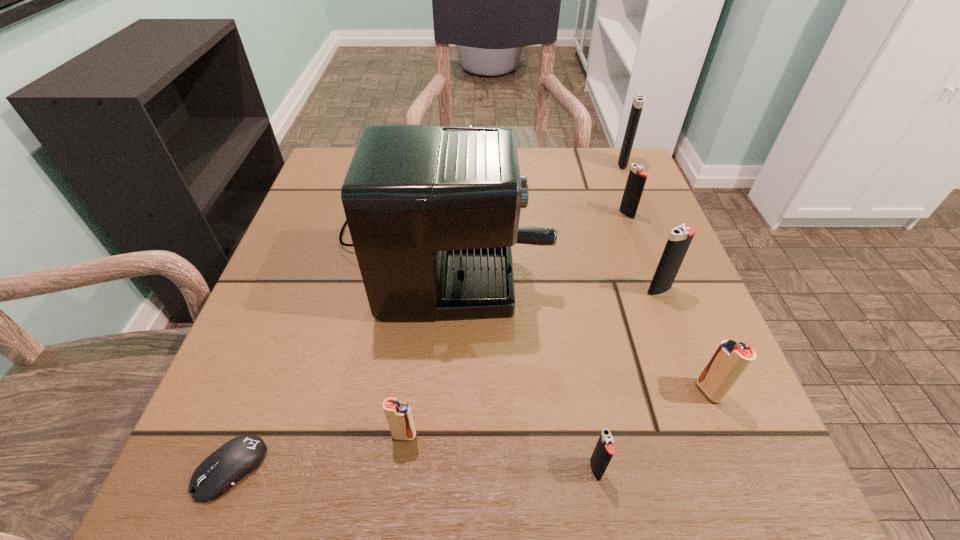
At what (x,y) coordinates should I click in order to perform the action: click on empty space that is in between the computer equipment and the black coffee maker. Please return your answer as a coordinate pair (x, y). Image resolution: width=960 pixels, height=540 pixels. Looking at the image, I should click on (336, 350).

This screenshot has height=540, width=960. I want to click on blank region between the computer equipment and the smaller red igniter, so click(318, 452).

The image size is (960, 540). In order to click on blank region between the black coffee maker and the farthest igniter in this screenshot , I will do `click(532, 198)`.

In order to click on vacant space in between the farther red igniter and the leftmost black igniter in this screenshot , I will do click(x=652, y=430).

Where is `free space between the black computer equipment and the smallest black igniter`? The height and width of the screenshot is (540, 960). free space between the black computer equipment and the smallest black igniter is located at coordinates (413, 469).

The width and height of the screenshot is (960, 540). I want to click on vacant area that lies between the computer equipment and the leftmost black igniter, so click(413, 469).

Identify the location of empty location between the fifth nearest igniter and the nearest black igniter. This screenshot has height=540, width=960. (612, 342).

Locate an element on the screen. Image resolution: width=960 pixels, height=540 pixels. the fifth closest object relative to the computer equipment is located at coordinates (680, 238).

Where is `object that is the fifth closest to the smallest black igniter`? The width and height of the screenshot is (960, 540). object that is the fifth closest to the smallest black igniter is located at coordinates (219, 472).

Where is `igniter that can be found as the second closest to the seventh shortest object`? This screenshot has height=540, width=960. igniter that can be found as the second closest to the seventh shortest object is located at coordinates (680, 238).